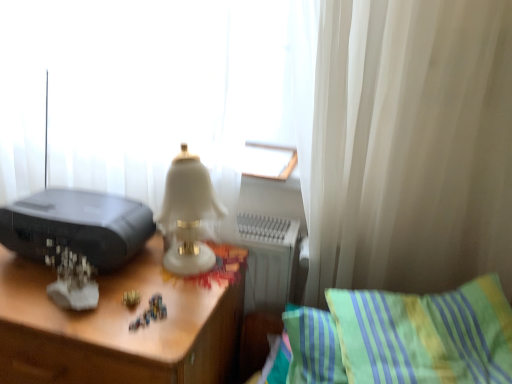
I want to click on vacant space in front of black plastic printer at left, so click(62, 305).